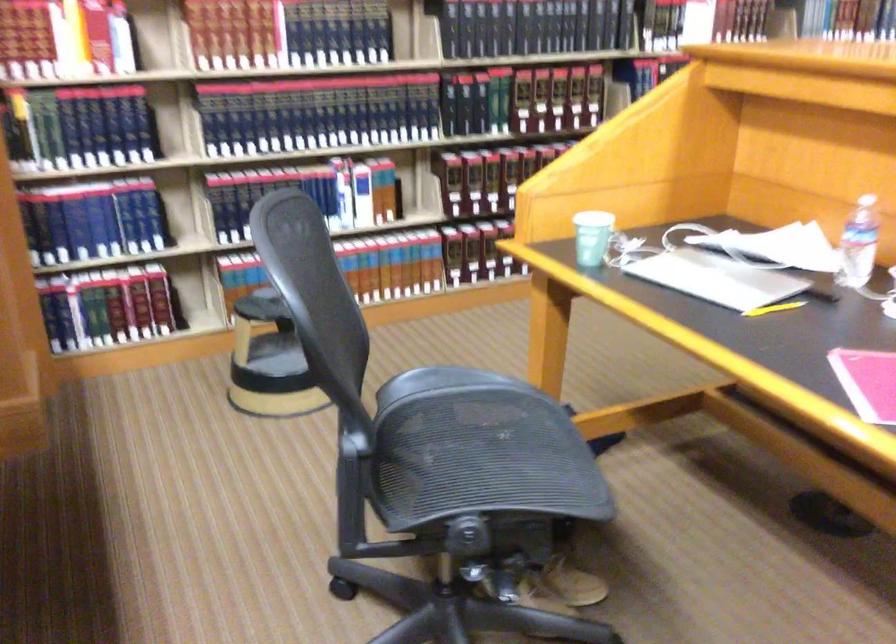
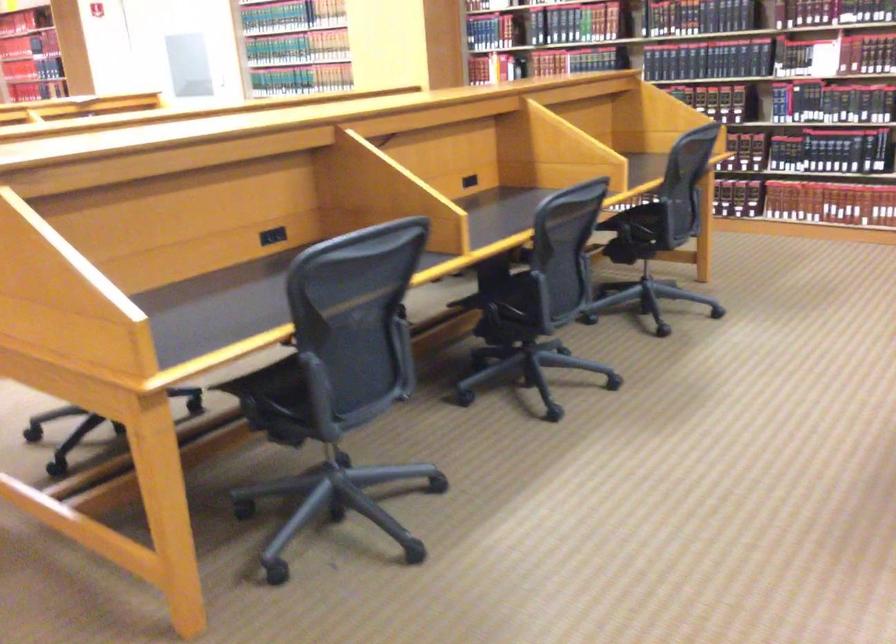
Question: I am providing you with two images of the same scene from different viewpoints. Please identify which objects are invisible in image2.

Choices:
 (A) hardcover book
 (B) black power outlet
 (C) orange tea box
 (D) chair armrest

Answer: (A)